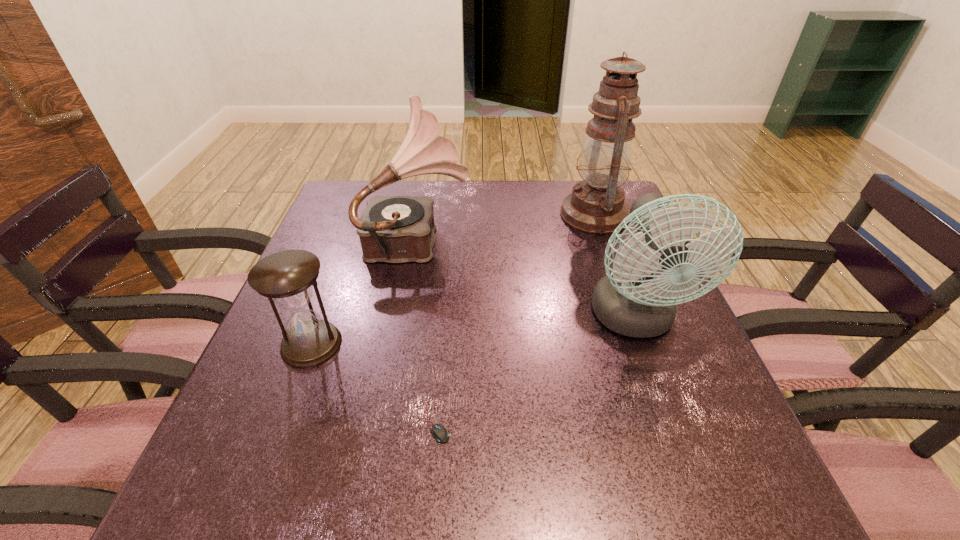
The width and height of the screenshot is (960, 540). Identify the location of free area in between the record player and the nearest object. (427, 331).

In order to click on vacant area that lies between the fan and the nearest object in this screenshot , I will do `click(535, 371)`.

Locate an element on the screen. Image resolution: width=960 pixels, height=540 pixels. object that ranks as the third closest to the second shortest object is located at coordinates point(631,301).

Find the location of `object that is the closest one to the oil lamp`. object that is the closest one to the oil lamp is located at coordinates (631, 301).

This screenshot has height=540, width=960. In order to click on free space that satisfies the following two spatial constraints: 1. from the horn of the record player; 2. on the left side of the shortest object in this screenshot , I will do `click(387, 423)`.

Image resolution: width=960 pixels, height=540 pixels. I want to click on free space that satisfies the following two spatial constraints: 1. on the front side of the oil lamp; 2. from the horn of the record player, so click(603, 239).

I want to click on free space that satisfies the following two spatial constraints: 1. from the horn of the record player; 2. on the front side of the fourth tallest object, so click(400, 345).